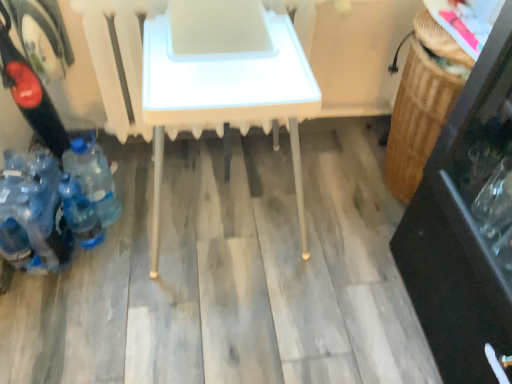
The width and height of the screenshot is (512, 384). What are the coordinates of `free space in front of blue plastic bottle at lower left, the 2th bottle positioned from the right` in the screenshot? It's located at (79, 283).